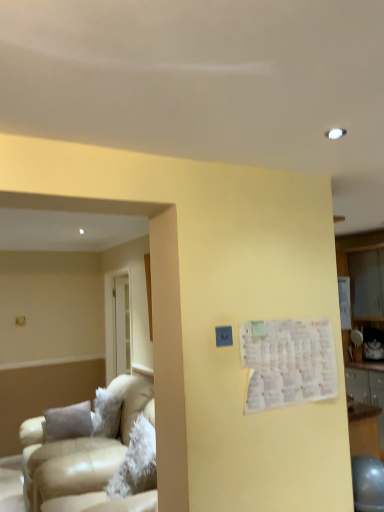
What do you see at coordinates (288, 362) in the screenshot?
I see `white paper at upper right` at bounding box center [288, 362].

Find the location of a particular element. The width and height of the screenshot is (384, 512). white paper at upper right is located at coordinates (288, 362).

Locate an element on the screen. This screenshot has width=384, height=512. beige leather couch at left is located at coordinates (84, 457).

The width and height of the screenshot is (384, 512). What do you see at coordinates (84, 457) in the screenshot? I see `beige leather couch at left` at bounding box center [84, 457].

Image resolution: width=384 pixels, height=512 pixels. I want to click on white paper at upper right, so click(x=288, y=362).

Is white paper at upper right at the right side of beige leather couch at left?

Yes.

Considering the positions of objects white paper at upper right and beige leather couch at left in the image provided, who is behind, white paper at upper right or beige leather couch at left?

beige leather couch at left.

Is point (251, 335) less distant than point (37, 457)?

Yes, point (251, 335) is in front of point (37, 457).

From the image's perspective, between white paper at upper right and beige leather couch at left, which one is located above?

white paper at upper right, from the image's perspective.

From a real-world perspective, is white paper at upper right positioned over beige leather couch at left based on gravity?

Correct, in the physical world, white paper at upper right is higher than beige leather couch at left.

Can you confirm if white paper at upper right is thinner than beige leather couch at left?

Yes.

Does white paper at upper right have a greater height compared to beige leather couch at left?

No.

Is white paper at upper right smaller than beige leather couch at left?

Indeed, white paper at upper right has a smaller size compared to beige leather couch at left.

Would you say beige leather couch at left is part of white paper at upper right's contents?

That's incorrect, beige leather couch at left is not inside white paper at upper right.

Are white paper at upper right and beige leather couch at left making contact?

They are not placed beside each other.

Could you tell me if white paper at upper right is facing beige leather couch at left?

No, white paper at upper right does not turn towards beige leather couch at left.

How different are the orientations of white paper at upper right and beige leather couch at left in degrees?

white paper at upper right and beige leather couch at left are facing 92.9 degrees away from each other.

Where is `studio couch below the white paper at upper right (from a real-world perspective)`? The image size is (384, 512). studio couch below the white paper at upper right (from a real-world perspective) is located at coordinates (84, 457).

Considering the relative positions of beige leather couch at left and white paper at upper right in the image provided, is beige leather couch at left to the right of white paper at upper right from the viewer's perspective?

No, beige leather couch at left is not to the right of white paper at upper right.

Looking at this image, is the position of beige leather couch at left less distant than that of white paper at upper right?

No, it is behind white paper at upper right.

Does point (70, 481) come behind point (255, 367)?

Yes, point (70, 481) is behind point (255, 367).

From the image's perspective, does beige leather couch at left appear higher than white paper at upper right?

Incorrect, from the image's perspective, beige leather couch at left is lower than white paper at upper right.

From a real-world perspective, does beige leather couch at left sit lower than white paper at upper right?

Yes, from a real-world perspective, beige leather couch at left is under white paper at upper right.

Which of these two, beige leather couch at left or white paper at upper right, is thinner?

white paper at upper right is thinner.

Looking at this image, which of these two, beige leather couch at left or white paper at upper right, stands taller?

beige leather couch at left is taller.

Is beige leather couch at left bigger than white paper at upper right?

Indeed, beige leather couch at left has a larger size compared to white paper at upper right.

Is beige leather couch at left spatially inside white paper at upper right, or outside of it?

beige leather couch at left is not enclosed by white paper at upper right.

Is beige leather couch at left touching white paper at upper right?

No, beige leather couch at left is not with white paper at upper right.

Could you tell me if beige leather couch at left is facing white paper at upper right?

No.

What's the angular difference between beige leather couch at left and white paper at upper right's facing directions?

They differ by 92.9 degrees in their facing directions.

Measure the distance between beige leather couch at left and white paper at upper right.

A distance of 3.96 feet exists between beige leather couch at left and white paper at upper right.

Locate an element on the screen. studio couch below the white paper at upper right (from the image's perspective) is located at coordinates point(84,457).

Locate an element on the screen. studio couch lying below the white paper at upper right (from the image's perspective) is located at coordinates point(84,457).

What are the coordinates of `studio couch below the white paper at upper right (from a real-world perspective)` in the screenshot? It's located at (84, 457).